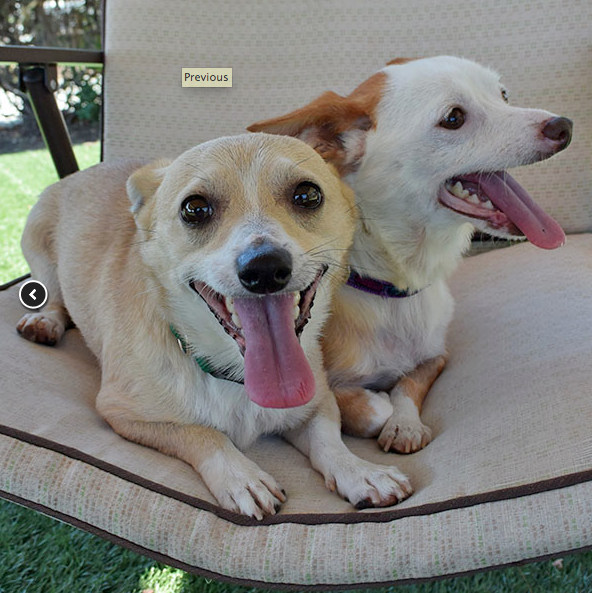
The width and height of the screenshot is (592, 593). What are the coordinates of `chair seat cushion` in the screenshot? It's located at (496, 388), (522, 283), (532, 458), (28, 358), (43, 416).